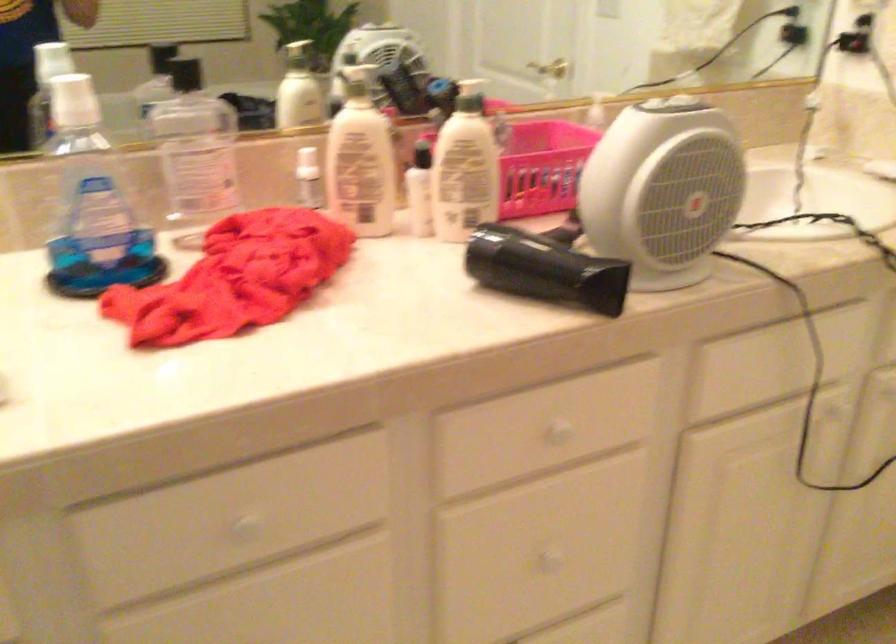
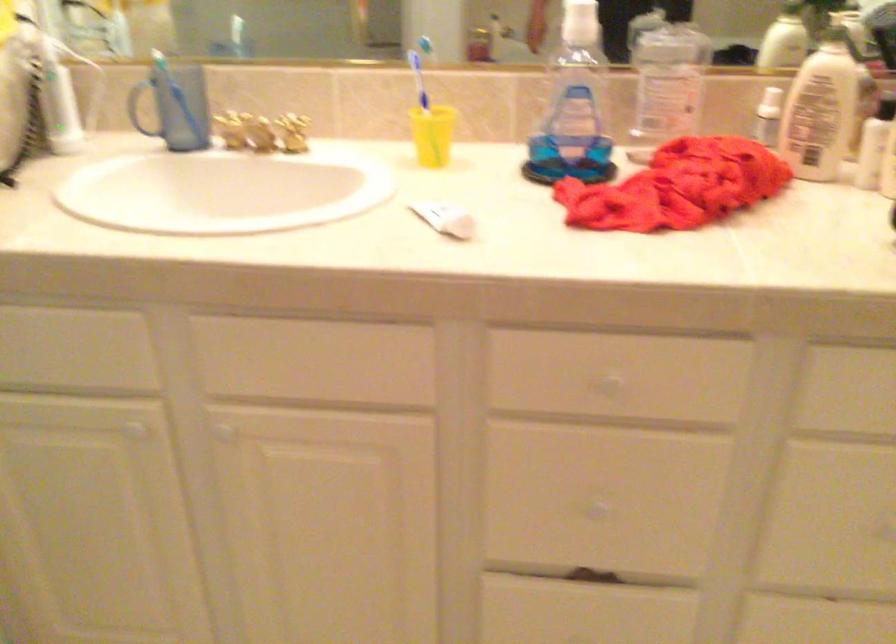
Find the pixel in the second image that matches (x=369, y=167) in the first image.

(821, 109)